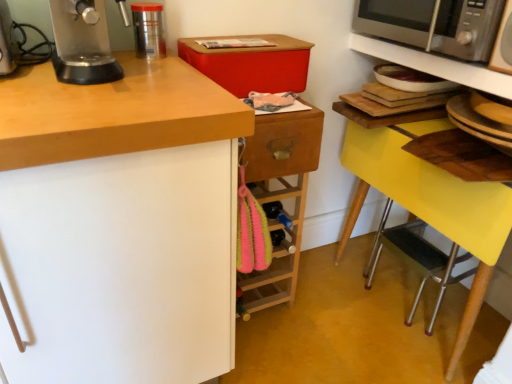
Question: Can you confirm if satin silver microwave at upper right is bigger than satin silver microwave at upper right?

Choices:
 (A) yes
 (B) no

Answer: (B)

Question: From a real-world perspective, is satin silver microwave at upper right located higher than satin silver microwave at upper right?

Choices:
 (A) no
 (B) yes

Answer: (B)

Question: Can we say satin silver microwave at upper right lies outside satin silver microwave at upper right?

Choices:
 (A) yes
 (B) no

Answer: (A)

Question: Does satin silver microwave at upper right appear on the right side of satin silver microwave at upper right?

Choices:
 (A) no
 (B) yes

Answer: (B)

Question: Is satin silver microwave at upper right at the left side of satin silver microwave at upper right?

Choices:
 (A) yes
 (B) no

Answer: (B)

Question: From a real-world perspective, is metallic silver microwave at upper right physically located above or below wooden drawer at center?

Choices:
 (A) below
 (B) above

Answer: (B)

Question: From the image's perspective, is metallic silver microwave at upper right positioned above or below wooden drawer at center?

Choices:
 (A) below
 (B) above

Answer: (B)

Question: Considering the positions of point (480, 69) and point (266, 135), is point (480, 69) closer or farther from the camera than point (266, 135)?

Choices:
 (A) closer
 (B) farther

Answer: (B)

Question: In the image, is metallic silver microwave at upper right on the left side or the right side of wooden drawer at center?

Choices:
 (A) left
 (B) right

Answer: (B)

Question: From the image's perspective, is wooden drawer at center positioned above or below metallic silver microwave at upper right?

Choices:
 (A) above
 (B) below

Answer: (B)

Question: Looking at the image, does wooden drawer at center seem bigger or smaller compared to metallic silver microwave at upper right?

Choices:
 (A) big
 (B) small

Answer: (B)

Question: Is wooden drawer at center in front of or behind metallic silver microwave at upper right in the image?

Choices:
 (A) behind
 (B) front

Answer: (A)

Question: Do you think wooden drawer at center is within metallic silver microwave at upper right, or outside of it?

Choices:
 (A) inside
 (B) outside

Answer: (B)

Question: Is satin silver microwave at upper right inside or outside of yellow plastic step stool at lower right?

Choices:
 (A) outside
 (B) inside

Answer: (A)

Question: Does point (506, 61) appear closer or farther from the camera than point (411, 256)?

Choices:
 (A) closer
 (B) farther

Answer: (A)